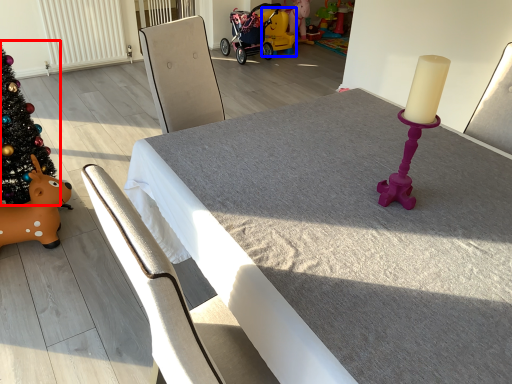
Question: Which object appears closest to the camera in this image, christmas tree (highlighted by a red box) or toy (highlighted by a blue box)?

Choices:
 (A) christmas tree
 (B) toy

Answer: (A)